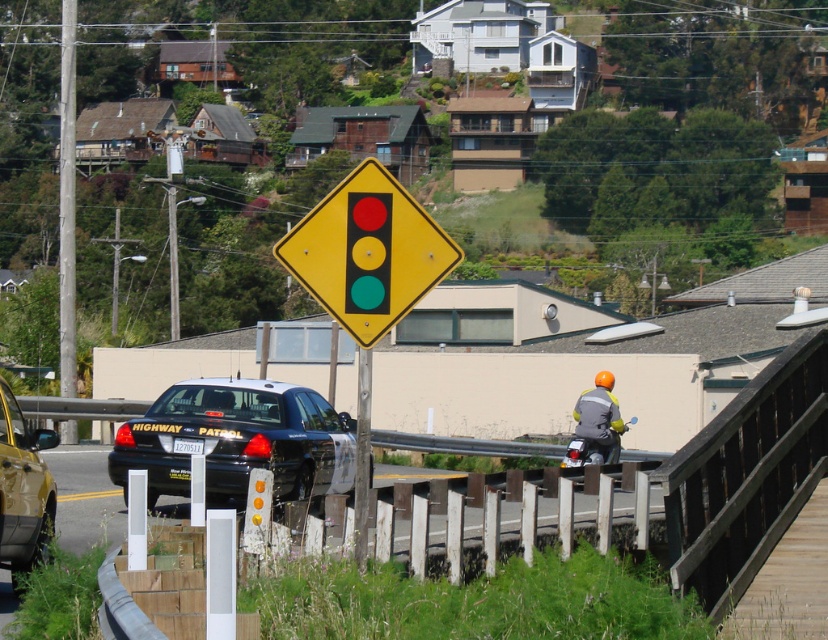
Question: Is wooden post at left thinner than metallic pole at center?

Choices:
 (A) yes
 (B) no

Answer: (B)

Question: Which point is closer to the camera?

Choices:
 (A) yellow diamond-shaped traffic sign at center
 (B) gold metallic car at lower left
 (C) wooden post at left

Answer: (A)

Question: Considering the relative positions of white glossy highway patrol car at center and gold metallic car at lower left in the image provided, where is white glossy highway patrol car at center located with respect to gold metallic car at lower left?

Choices:
 (A) left
 (B) right

Answer: (B)

Question: Does yellow diamond-shaped traffic sign at center have a lesser width compared to metallic pole at center?

Choices:
 (A) no
 (B) yes

Answer: (A)

Question: Estimate the real-world distances between objects in this image. Which object is farther from the white glossy highway patrol car at center?

Choices:
 (A) gray fabric construction worker at right
 (B) yellow diamond-shaped traffic sign at center
 (C) gold metallic car at lower left
 (D) metallic pole at center

Answer: (B)

Question: Among these points, which one is nearest to the camera?

Choices:
 (A) (3, 417)
 (B) (71, 13)
 (C) (615, 416)
 (D) (357, 397)

Answer: (A)